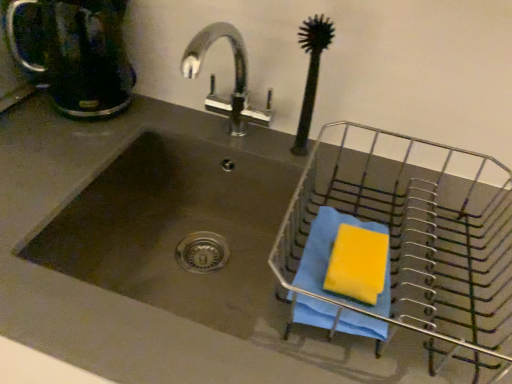
The image size is (512, 384). In order to click on vacant space to the right of black rubber brush at upper right in this screenshot , I will do `click(370, 176)`.